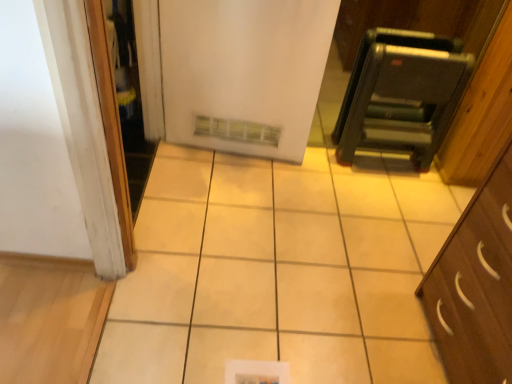
Locate an element on the screen. vacant space to the right of white glossy screen door at left is located at coordinates (215, 207).